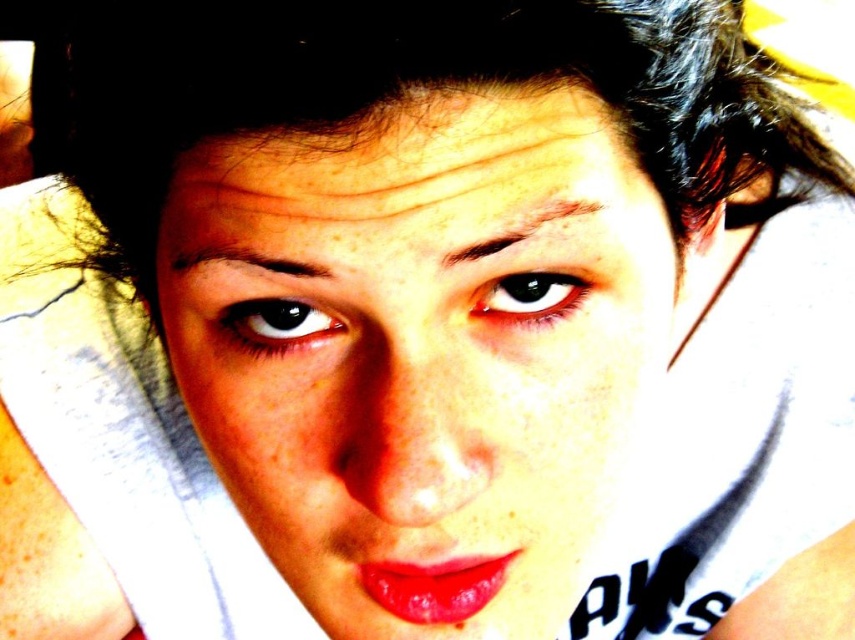
Question: Which object is closer to the camera taking this photo?

Choices:
 (A) dark brown eye at center
 (B) dark brown hair at upper center
 (C) smooth skin face at center
 (D) dry skin at center

Answer: (B)

Question: Estimate the real-world distances between objects in this image. Which object is farther from the dark brown eye at center?

Choices:
 (A) dry skin at center
 (B) dark brown hair at upper center
 (C) smooth skin face at center

Answer: (B)

Question: Can you confirm if dark brown hair at upper center is thinner than dark brown eye at center?

Choices:
 (A) no
 (B) yes

Answer: (A)

Question: Which point is closer to the camera?

Choices:
 (A) dry skin at center
 (B) dark brown hair at upper center
 (C) black glossy eye at upper left
 (D) dark brown eye at center

Answer: (B)

Question: Is smooth skin face at center further to camera compared to dark brown eye at center?

Choices:
 (A) no
 (B) yes

Answer: (A)

Question: Is dry skin at center behind dark brown eye at center?

Choices:
 (A) no
 (B) yes

Answer: (A)